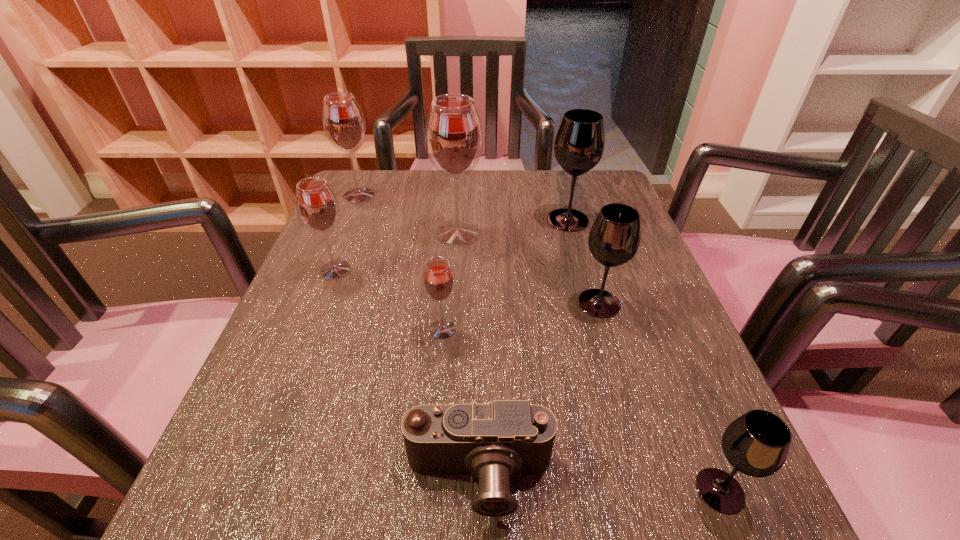
This screenshot has height=540, width=960. I want to click on object that is the fifth nearest to the second smallest gray wineglass, so click(757, 443).

Find the location of `wineglass identified as the sixth closest to the second nearest red wineglass`. wineglass identified as the sixth closest to the second nearest red wineglass is located at coordinates (757, 443).

Image resolution: width=960 pixels, height=540 pixels. I want to click on wineglass that is the closest to the farthest gray wineglass, so click(453, 134).

Point out which red wineglass is positioned as the second nearest to the biggest gray wineglass. Please provide its 2D coordinates. Your answer should be formatted as a tuple, i.e. [(x, y)], where the tuple contains the x and y coordinates of a point satisfying the conditions above.

[(438, 280)]

Where is `red wineglass identified as the second closest to the tallest wineglass`? red wineglass identified as the second closest to the tallest wineglass is located at coordinates (343, 121).

Identify which gray wineglass is the nearest to the smallest red wineglass. Please provide its 2D coordinates. Your answer should be formatted as a tuple, i.e. [(x, y)], where the tuple contains the x and y coordinates of a point satisfying the conditions above.

[(614, 238)]

Locate which gray wineglass ranks second in proximity to the shortest object. Please provide its 2D coordinates. Your answer should be formatted as a tuple, i.e. [(x, y)], where the tuple contains the x and y coordinates of a point satisfying the conditions above.

[(614, 238)]

Where is `free spot that satisfies the following two spatial constraints: 1. on the front side of the smallest red wineglass; 2. on the right side of the third farthest red wineglass`? The image size is (960, 540). free spot that satisfies the following two spatial constraints: 1. on the front side of the smallest red wineglass; 2. on the right side of the third farthest red wineglass is located at coordinates (312, 329).

At what (x,y) coordinates should I click in order to perform the action: click on free spot that satisfies the following two spatial constraints: 1. on the front side of the fifth nearest object; 2. on the left side of the smallest red wineglass. Please return your answer as a coordinate pair (x, y). The width and height of the screenshot is (960, 540). Looking at the image, I should click on (312, 329).